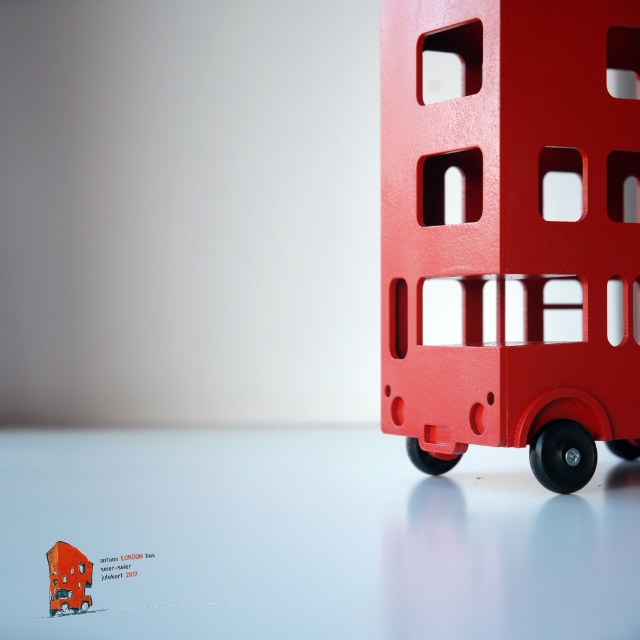
Question: Does matte plastic bus at right have a larger size compared to matte red bus at center?

Choices:
 (A) yes
 (B) no

Answer: (A)

Question: Does matte plastic bus at right come in front of matte red bus at center?

Choices:
 (A) no
 (B) yes

Answer: (A)

Question: Can you confirm if matte plastic bus at right is wider than matte red bus at center?

Choices:
 (A) yes
 (B) no

Answer: (A)

Question: Which point is closer to the camera?

Choices:
 (A) (397, 144)
 (B) (49, 593)

Answer: (B)